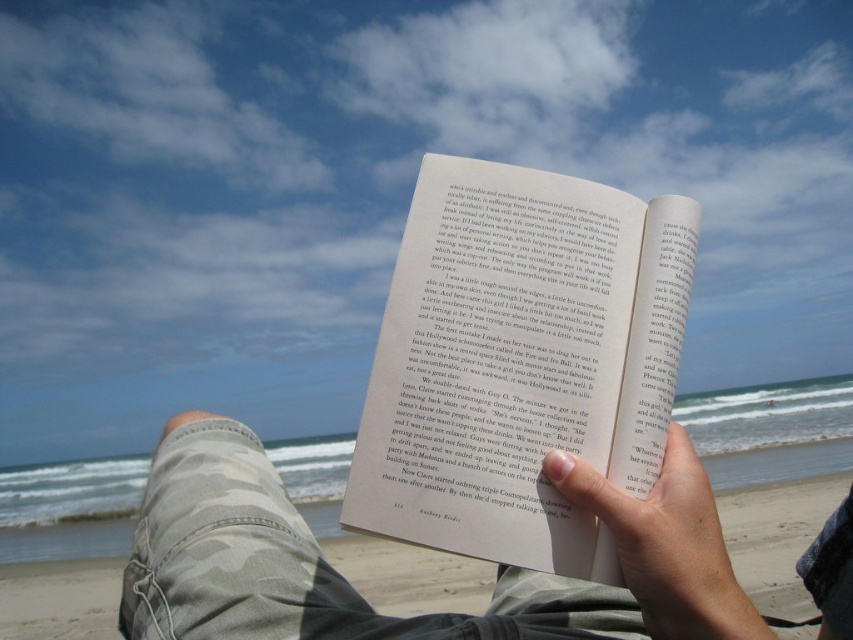
Question: Does camouflage pants at lower left have a larger size compared to smooth skin hand at center?

Choices:
 (A) no
 (B) yes

Answer: (B)

Question: Does matte paper book at center appear under smooth skin hand at center?

Choices:
 (A) yes
 (B) no

Answer: (B)

Question: Which object is farther from the camera taking this photo?

Choices:
 (A) smooth skin hand at center
 (B) camouflage pants at lower left
 (C) matte paper book at center

Answer: (C)

Question: Estimate the real-world distances between objects in this image. Which object is closer to the camouflage pants at lower left?

Choices:
 (A) matte paper book at center
 (B) smooth skin hand at center

Answer: (B)

Question: Which object is closer to the camera taking this photo?

Choices:
 (A) matte paper book at center
 (B) smooth skin hand at center

Answer: (B)

Question: Can you confirm if matte paper book at center is wider than camouflage pants at lower left?

Choices:
 (A) no
 (B) yes

Answer: (A)